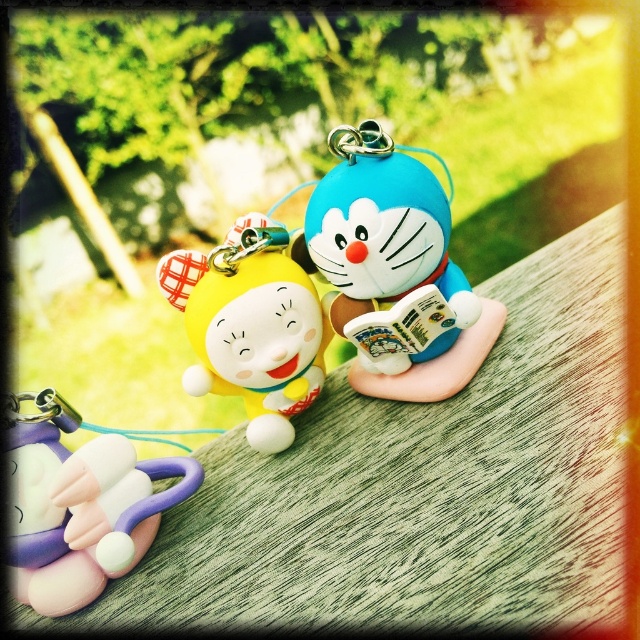
Question: Which point is farther from the camera taking this photo?

Choices:
 (A) (32, 483)
 (B) (428, 170)
 (C) (296, 390)

Answer: (C)

Question: Which point is closer to the camera taking this photo?

Choices:
 (A) (257, 243)
 (B) (339, 182)

Answer: (B)

Question: Is matte plastic doraemon at center positioned behind yellow matte plush at center?

Choices:
 (A) no
 (B) yes

Answer: (A)

Question: Estimate the real-world distances between objects in this image. Which object is farther from the pink rubber toy at lower left?

Choices:
 (A) yellow matte plush at center
 (B) matte plastic doraemon at center

Answer: (B)

Question: Can you confirm if pink rubber toy at lower left is wider than yellow matte plush at center?

Choices:
 (A) yes
 (B) no

Answer: (A)

Question: Is matte plastic doraemon at center positioned at the back of pink rubber toy at lower left?

Choices:
 (A) yes
 (B) no

Answer: (A)